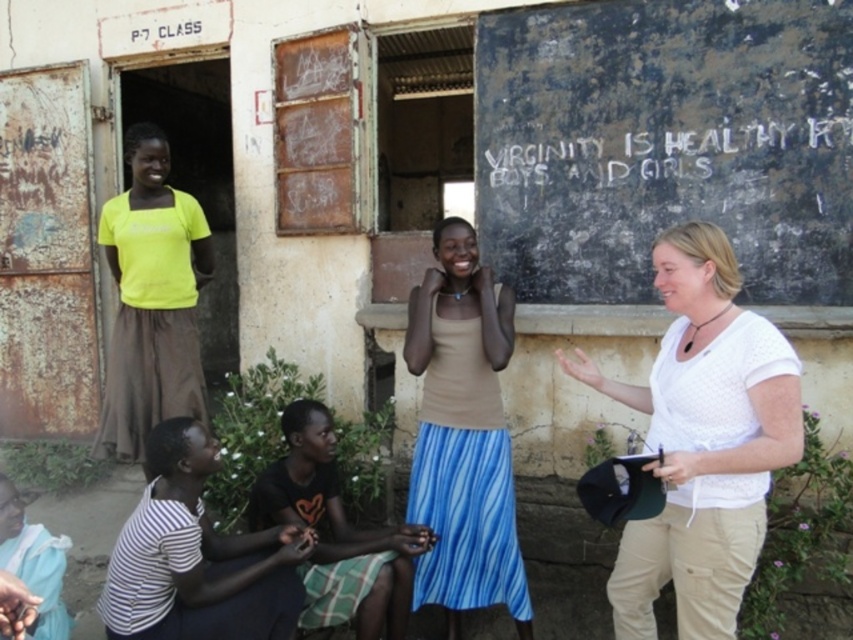
Question: Estimate the real-world distances between objects in this image. Which object is farther from the light blue fabric at lower left?

Choices:
 (A) white textured shirt at center
 (B) white chalk writing at upper center
 (C) dark brown fabric shirt at lower left
 (D) white striped shirt at lower left

Answer: (B)

Question: Considering the relative positions of matte beige tank top at center and light blue fabric at lower left in the image provided, where is matte beige tank top at center located with respect to light blue fabric at lower left?

Choices:
 (A) above
 (B) below

Answer: (A)

Question: Does white textured shirt at center appear under light blue fabric at lower left?

Choices:
 (A) yes
 (B) no

Answer: (B)

Question: Among these points, which one is nearest to the camera?

Choices:
 (A) (315, 460)
 (B) (717, 132)
 (C) (3, 556)

Answer: (C)

Question: Does dark brown fabric shirt at lower left appear over white chalk writing at upper center?

Choices:
 (A) yes
 (B) no

Answer: (B)

Question: Which object is the closest to the neon yellow fabric at upper left?

Choices:
 (A) white textured shirt at center
 (B) light blue fabric at lower left
 (C) white striped shirt at lower left

Answer: (B)